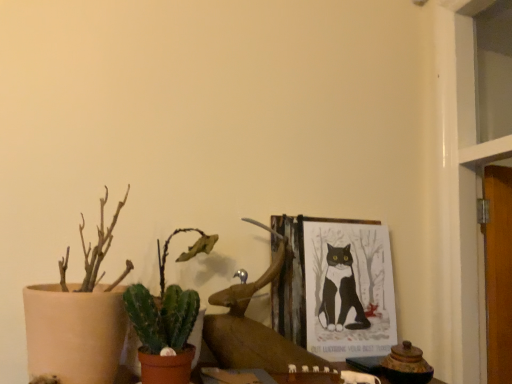
Question: From a real-world perspective, relative to green matte cactus at lower left, the 2th houseplant positioned from the left, is green succulent at lower left vertically above or below?

Choices:
 (A) below
 (B) above

Answer: (A)

Question: Based on their sizes in the image, would you say green succulent at lower left is bigger or smaller than green matte cactus at lower left, the 2th houseplant positioned from the left?

Choices:
 (A) small
 (B) big

Answer: (A)

Question: Which object is the closest to the wooden picture frame at upper center?

Choices:
 (A) green succulent at lower left
 (B) green matte cactus at lower left, the 2th houseplant positioned from the left
 (C) matte beige pot at left, the second houseplant from the right

Answer: (B)

Question: Estimate the real-world distances between objects in this image. Which object is farther from the wooden picture frame at upper center?

Choices:
 (A) matte beige pot at left, the first houseplant from the left
 (B) green succulent at lower left
 (C) green matte cactus at lower left, the 2th houseplant positioned from the left

Answer: (A)